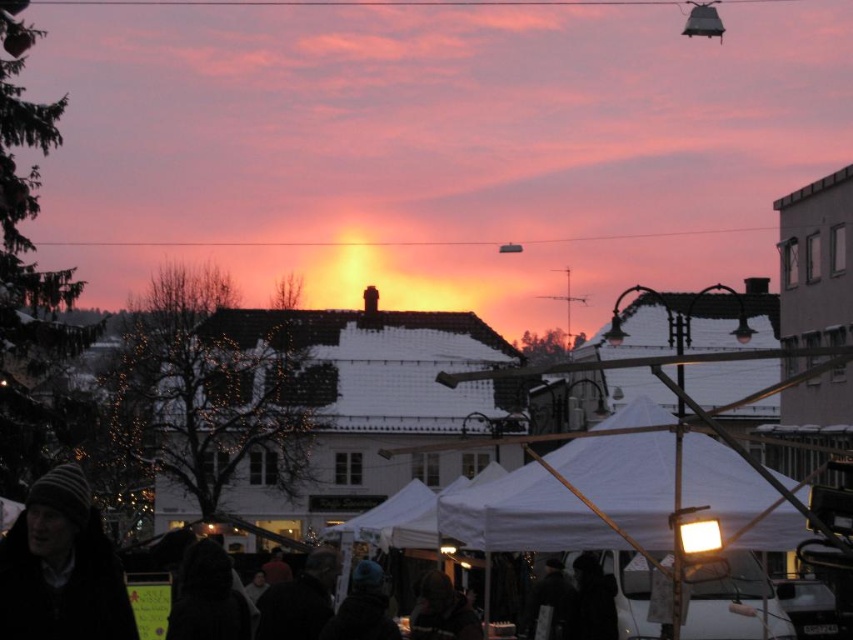
Does white fabric canopy at center have a larger size compared to dark blue knit hat at center?

Yes, white fabric canopy at center is bigger than dark blue knit hat at center.

From the picture: Is white fabric canopy at center smaller than dark blue knit hat at center?

No.

Is point (556, 461) positioned after point (355, 592)?

Yes, it is.

This screenshot has width=853, height=640. Identify the location of white fabric canopy at center. (523, 515).

Does dark blue knit hat at center have a lesser height compared to dark gray fabric jacket at lower center?

Incorrect, dark blue knit hat at center's height does not fall short of dark gray fabric jacket at lower center's.

Locate an element on the screen. The width and height of the screenshot is (853, 640). dark blue knit hat at center is located at coordinates tap(363, 608).

The height and width of the screenshot is (640, 853). What are the coordinates of `dark blue knit hat at center` in the screenshot? It's located at [363, 608].

Is point (585, 620) less distant than point (553, 616)?

Yes, it is.

Between point (592, 618) and point (546, 596), which one is positioned in front?

Point (592, 618) is in front.

Between point (584, 572) and point (564, 618), which one is positioned behind?

The point (584, 572) is more distant.

Where is `dark fabric coat at center`? Image resolution: width=853 pixels, height=640 pixels. dark fabric coat at center is located at coordinates tap(592, 600).